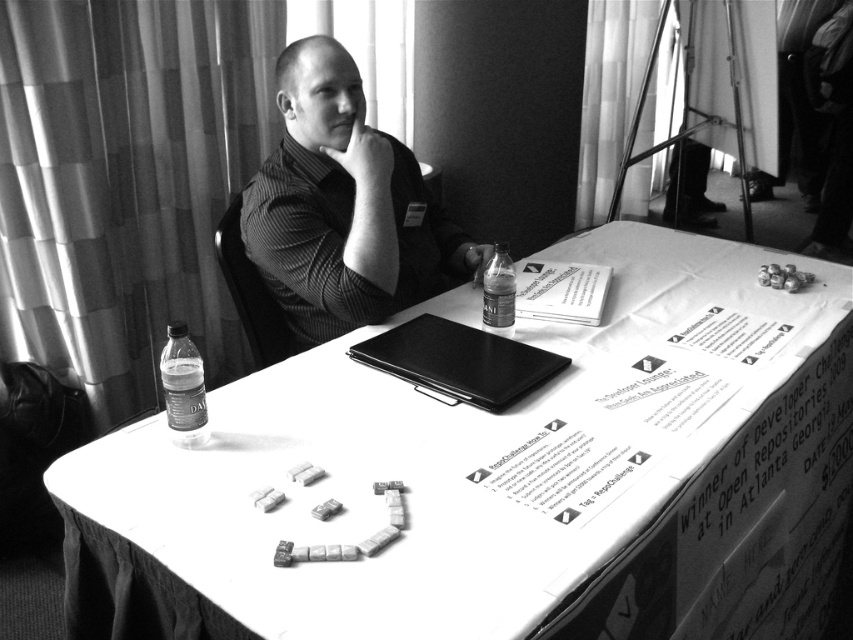
You are organizing a small conference and need to place a name tag on the table. The name tag is the same size as the translucent plastic bottle at lower left. Can you fit it next to the black matte laptop at center without overlapping?

The black matte laptop at center is larger in size than the translucent plastic bottle at lower left. Since the name tag is the same size as the bottle, there should be enough space next to the laptop to place it without overlapping, as the laptop itself is bigger and likely leaves room for smaller items.